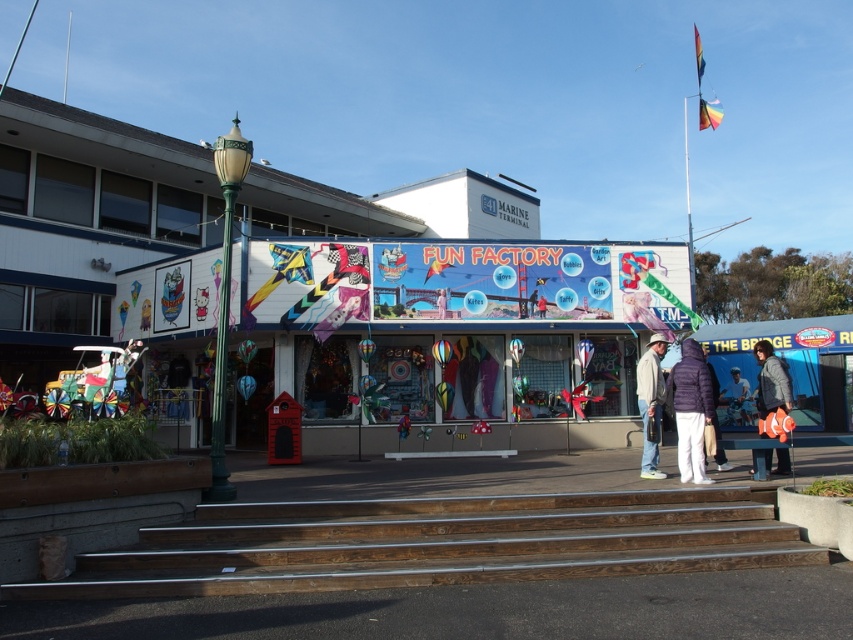
You are standing in front of the Fun Factory store and see the wooden stairs at center and the white fabric person at center. Which object is smaller in size?

Answer: The wooden stairs at center is smaller in size compared to the white fabric person at center.

You are a delivery person who needs to place a package on a shelf that can only hold items up to the height of the white fabric person at center. Can you safely place the purple down jacket at lower center on this shelf?

The purple down jacket at lower center is taller than the white fabric person at center, so placing it on the shelf would exceed the height limit. The package cannot be safely placed there.

You are standing in front of the Fun Factory storefront and notice two points marked on the sign. The first point is at coordinates point (556,572) and the second is at point (746,410). Which point is closer to you?

Point (556,572) is closer to the camera than point (746,410), so the first point is closer to you.